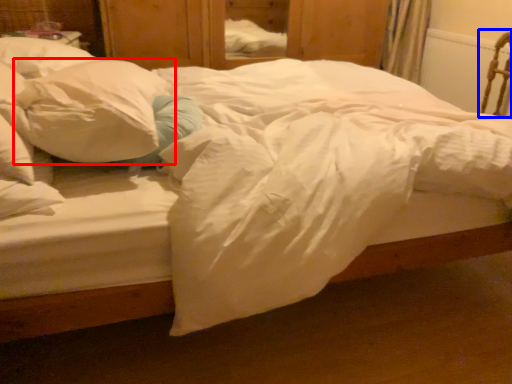
Question: Which of the following is the farthest to the observer, pillow (highlighted by a red box) or armchair (highlighted by a blue box)?

Choices:
 (A) pillow
 (B) armchair

Answer: (B)